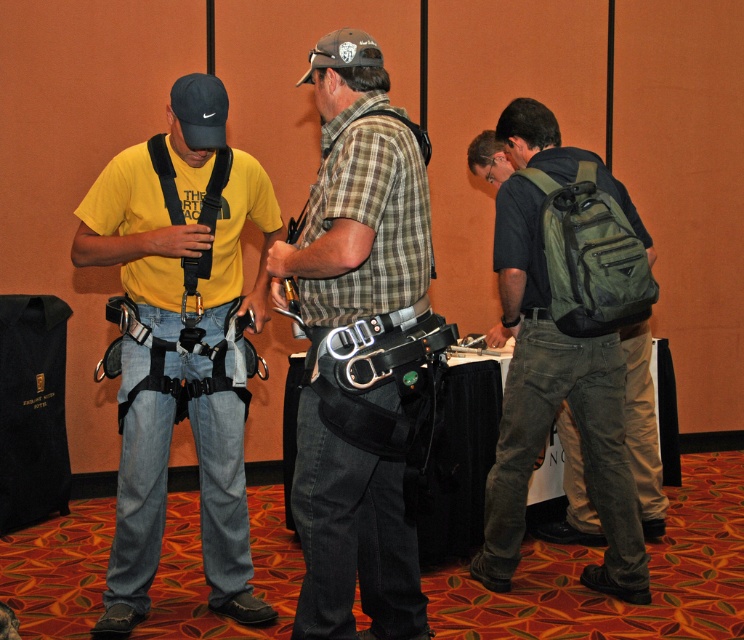
You are organizing a safety inspection in the conference room. You need to ensure that the plaid fabric shirt at center and the green canvas backpack at right are within the camera frame. Which object requires more space to be fully captured by the camera?

The green canvas backpack at right requires more space to be fully captured by the camera because the plaid fabric shirt at center occupies less space than the green canvas backpack at right.

You are standing in the conference room and see two points marked in the image. Which point is closer to you, point (x=161, y=161) or point (x=339, y=65)?

Point (x=339, y=65) is closer to you because the Objects Description states that point (x=161, y=161) is behind point (x=339, y=65).

Where is the plaid fabric shirt at center located?

The plaid fabric shirt at center is located at point (336, 360).